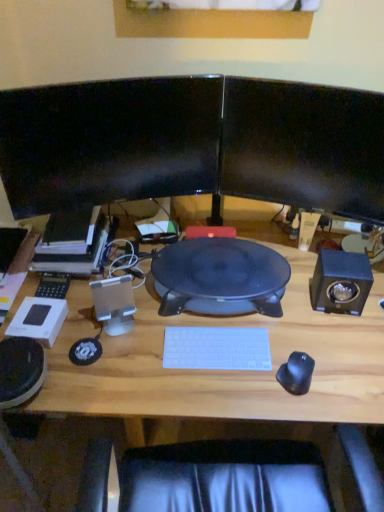
Where is `vacant space to the right of white plastic keyboard at center`? vacant space to the right of white plastic keyboard at center is located at coordinates (289, 349).